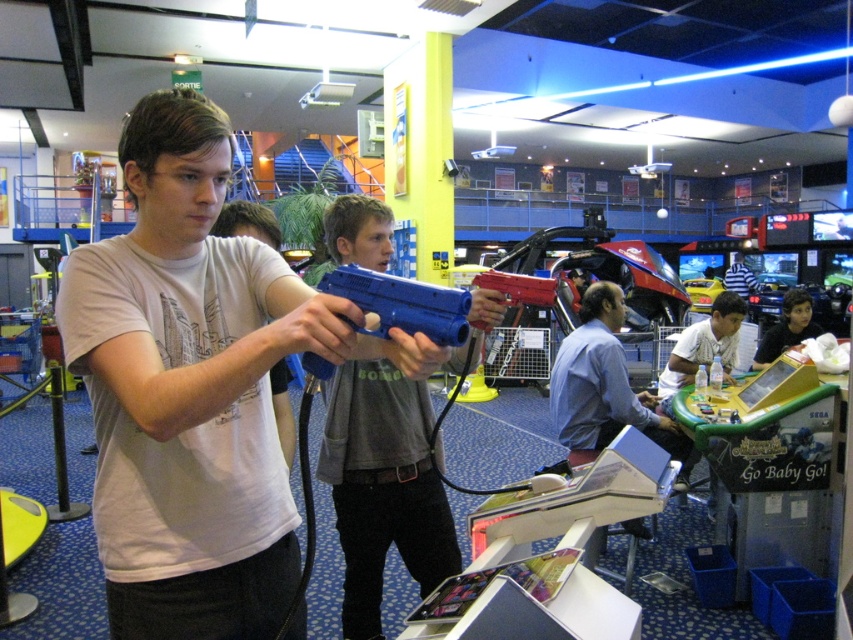
Question: Which object is farther from the camera taking this photo?

Choices:
 (A) blue plastic gun at center
 (B) blue plastic water gun at center

Answer: (A)

Question: Which point is closer to the camera?

Choices:
 (A) blue plastic gun at center
 (B) matte white t-shirt at center

Answer: (B)

Question: Estimate the real-world distances between objects in this image. Which object is farther from the blue plastic gun at center?

Choices:
 (A) matte white t-shirt at center
 (B) dark blue shirt at center
 (C) blue plastic water gun at center
 (D) blue shirt at center

Answer: (B)

Question: Can you confirm if blue plastic gun at center is wider than blue plastic water gun at center?

Choices:
 (A) yes
 (B) no

Answer: (A)

Question: Is matte white t-shirt at center to the left of blue plastic water gun at center from the viewer's perspective?

Choices:
 (A) no
 (B) yes

Answer: (B)

Question: Is the position of blue shirt at center less distant than that of blue plastic water gun at center?

Choices:
 (A) yes
 (B) no

Answer: (B)